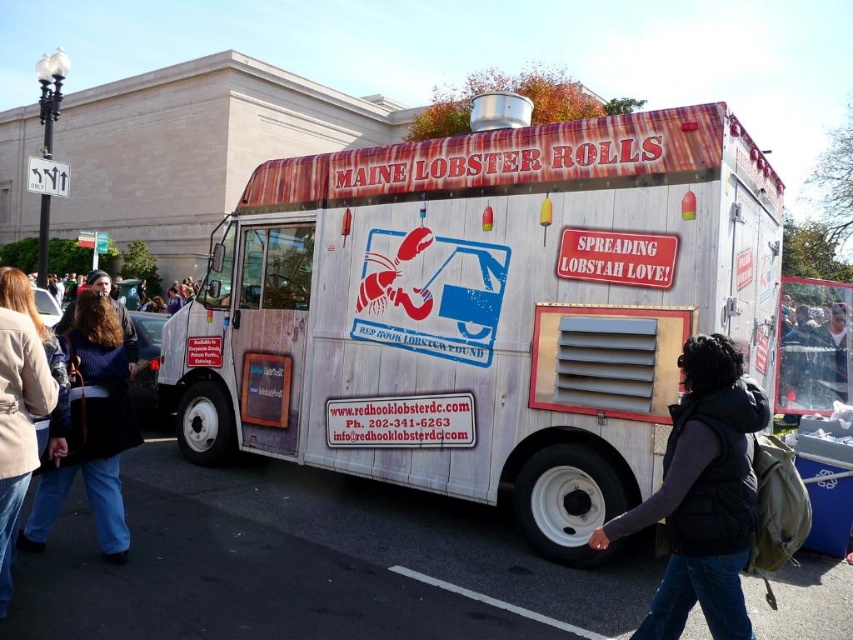
Question: Among these points, which one is farthest from the camera?

Choices:
 (A) (117, 442)
 (B) (541, 321)
 (C) (724, 417)
 (D) (15, 348)

Answer: (B)

Question: From the image, what is the correct spatial relationship of black puffer vest at lower right in relation to beige leather jacket at lower left?

Choices:
 (A) left
 (B) right

Answer: (B)

Question: Among these points, which one is farthest from the camera?

Choices:
 (A) (3, 268)
 (B) (714, 356)
 (C) (21, 536)

Answer: (A)

Question: Can you confirm if blue denim jeans at lower left is positioned to the left of beige leather jacket at lower left?

Choices:
 (A) yes
 (B) no

Answer: (A)

Question: Based on their relative distances, which object is farther from the blue denim jeans at lower left?

Choices:
 (A) black puffer vest at lower right
 (B) beige leather jacket at lower left

Answer: (A)

Question: Can you confirm if wooden food truck at center is positioned to the left of beige leather jacket at lower left?

Choices:
 (A) yes
 (B) no

Answer: (B)